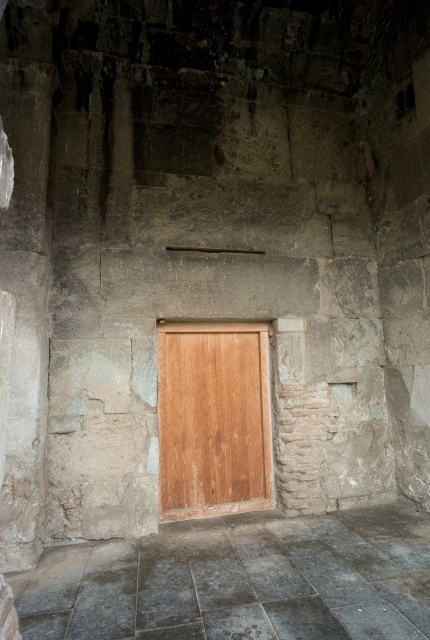
Between point (421, 516) and point (163, 349), which one is positioned behind?

The point (163, 349) is behind.

Where is `smooth stone floor at center`? This screenshot has height=640, width=430. smooth stone floor at center is located at coordinates (239, 579).